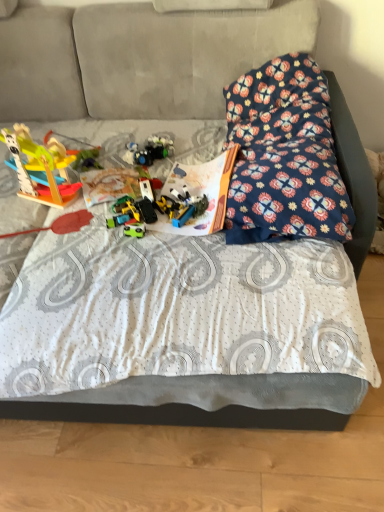
Question: From the image's perspective, is translucent plastic toys at center, acting as the 5th toy starting from the left, under wooden toy at left, which is the sixth toy in right-to-left order?

Choices:
 (A) no
 (B) yes

Answer: (A)

Question: Is translucent plastic toys at center, acting as the 2th toy starting from the right, in front of wooden toy at left, the first toy viewed from the left?

Choices:
 (A) yes
 (B) no

Answer: (B)

Question: Can we say translucent plastic toys at center, acting as the 5th toy starting from the left, lies outside wooden toy at left, which is the sixth toy in right-to-left order?

Choices:
 (A) yes
 (B) no

Answer: (A)

Question: Considering the relative positions of translucent plastic toys at center, acting as the 2th toy starting from the right, and wooden toy at left, the first toy viewed from the left, in the image provided, is translucent plastic toys at center, acting as the 2th toy starting from the right, to the right of wooden toy at left, the first toy viewed from the left, from the viewer's perspective?

Choices:
 (A) no
 (B) yes

Answer: (B)

Question: Based on their positions, is wooden toy at left, which is the sixth toy in right-to-left order, located to the left or right of translucent plastic toys at center, acting as the 5th toy starting from the left?

Choices:
 (A) right
 (B) left

Answer: (B)

Question: Is wooden toy at left, which is the sixth toy in right-to-left order, wider or thinner than translucent plastic toys at center, acting as the 2th toy starting from the right?

Choices:
 (A) thin
 (B) wide

Answer: (A)

Question: From the image's perspective, is wooden toy at left, which is the sixth toy in right-to-left order, located above or below translucent plastic toys at center, acting as the 2th toy starting from the right?

Choices:
 (A) below
 (B) above

Answer: (A)

Question: Considering the positions of wooden toy at left, the first toy viewed from the left, and translucent plastic toys at center, acting as the 2th toy starting from the right, in the image, is wooden toy at left, the first toy viewed from the left, taller or shorter than translucent plastic toys at center, acting as the 2th toy starting from the right,?

Choices:
 (A) tall
 (B) short

Answer: (A)

Question: Is translucent plastic toys at center, acting as the 5th toy starting from the left, in front of or behind floral fabric pillow at upper right in the image?

Choices:
 (A) behind
 (B) front

Answer: (A)

Question: From the image's perspective, is translucent plastic toys at center, acting as the 2th toy starting from the right, located above or below floral fabric pillow at upper right?

Choices:
 (A) above
 (B) below

Answer: (A)

Question: Considering the positions of translucent plastic toys at center, acting as the 2th toy starting from the right, and floral fabric pillow at upper right in the image, is translucent plastic toys at center, acting as the 2th toy starting from the right, taller or shorter than floral fabric pillow at upper right?

Choices:
 (A) short
 (B) tall

Answer: (A)

Question: Considering the positions of point (160, 158) and point (309, 122), is point (160, 158) closer or farther from the camera than point (309, 122)?

Choices:
 (A) farther
 (B) closer

Answer: (A)

Question: From a real-world perspective, relative to plastic toy car at center, the sixth toy when ordered from left to right, is wooden toy at left, the first toy viewed from the left, vertically above or below?

Choices:
 (A) above
 (B) below

Answer: (A)

Question: Considering the positions of point (16, 140) and point (178, 223), is point (16, 140) closer or farther from the camera than point (178, 223)?

Choices:
 (A) farther
 (B) closer

Answer: (A)